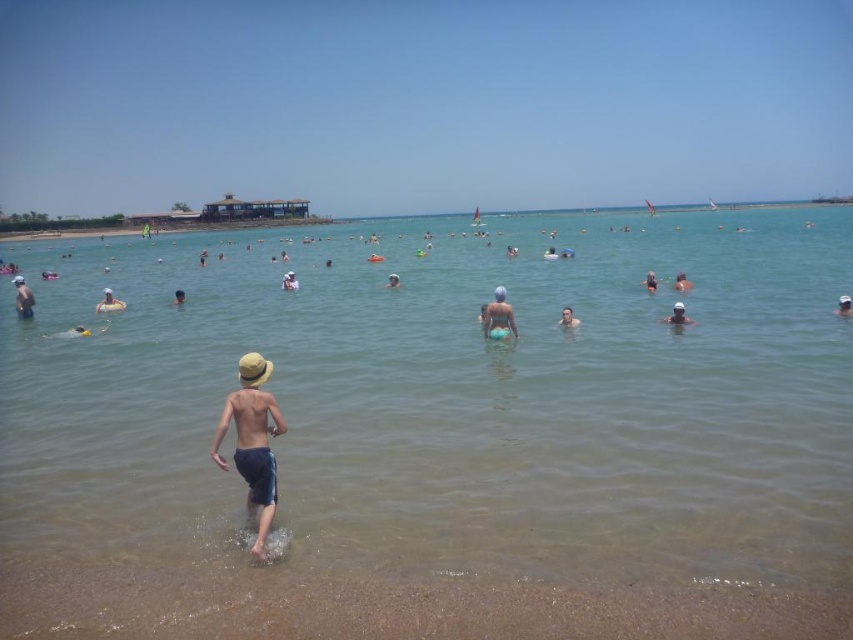
You are a photographer standing on the beach and want to capture a photo of the clear water at center and the light yellow straw hat at left. Which object should you focus on first if you want to ensure both are in focus?

The light yellow straw hat at left is closer to you than the clear water at center, so you should focus on the light yellow straw hat at left first to ensure both are in focus.

You are a lifeguard on duty and need to assess if the smooth skin person at center and the dark blue swimsuit at center are close enough to be considered the same individual. According to safety protocols, two objects must be within 4 feet to be linked. Can you confirm if they are within the required distance?

The smooth skin person at center and the dark blue swimsuit at center are 4.14 feet apart, which exceeds the 4 feet requirement. Therefore, they cannot be considered the same individual under the safety protocols.